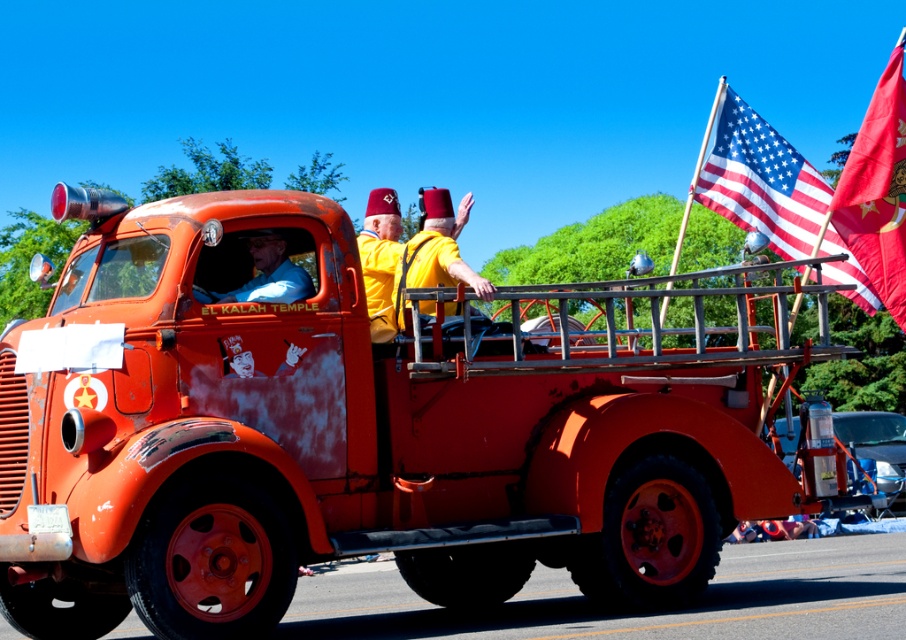
Does rusty orange fire truck at center appear under yellow matte fez at center?

Yes, rusty orange fire truck at center is below yellow matte fez at center.

Where is `rusty orange fire truck at center`? rusty orange fire truck at center is located at coordinates (353, 433).

Does red fabric flag at upper right have a smaller size compared to yellow matte fez at center?

Actually, red fabric flag at upper right might be larger than yellow matte fez at center.

Based on the photo, which is more to the left, red fabric flag at upper right or yellow matte fez at center?

yellow matte fez at center is more to the left.

In order to click on red fabric flag at upper right in this screenshot , I will do `click(878, 189)`.

From the picture: Measure the distance between point (856, 282) and camera.

The distance of point (856, 282) from camera is 32.59 feet.

Where is `american flag at upper center`? This screenshot has width=906, height=640. american flag at upper center is located at coordinates (760, 180).

This screenshot has height=640, width=906. In order to click on american flag at upper center in this screenshot , I will do `click(760, 180)`.